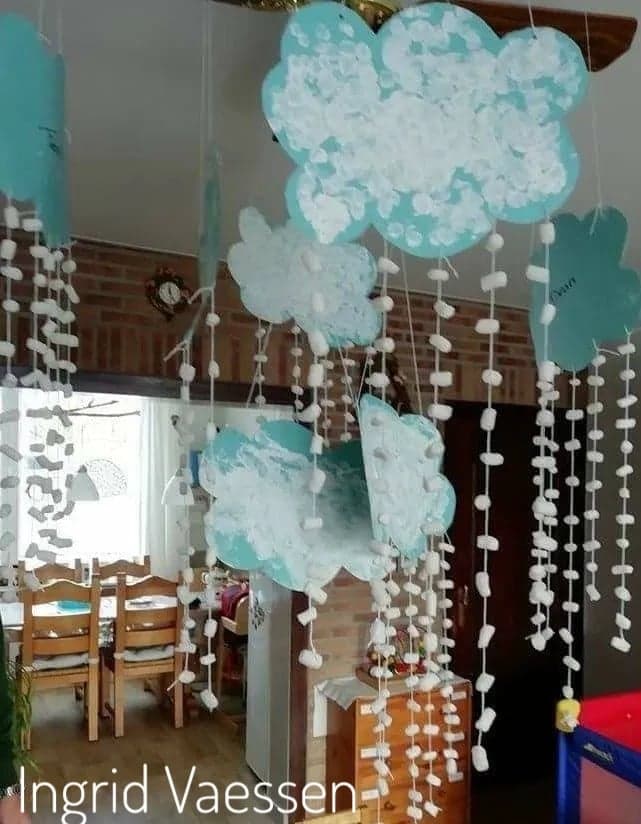
This screenshot has width=641, height=824. I want to click on playpen, so click(x=615, y=747).